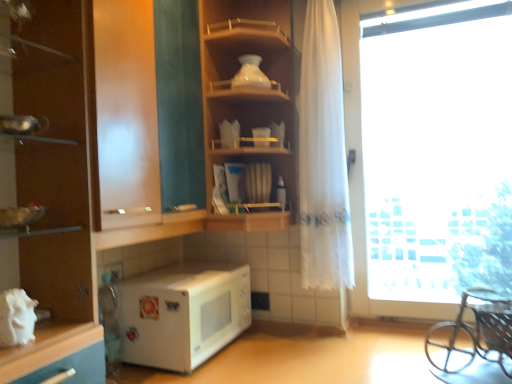
Identify the location of free space below metallic silver baby carriage at lower right (from a real-world perspective). Image resolution: width=512 pixels, height=384 pixels. (460, 367).